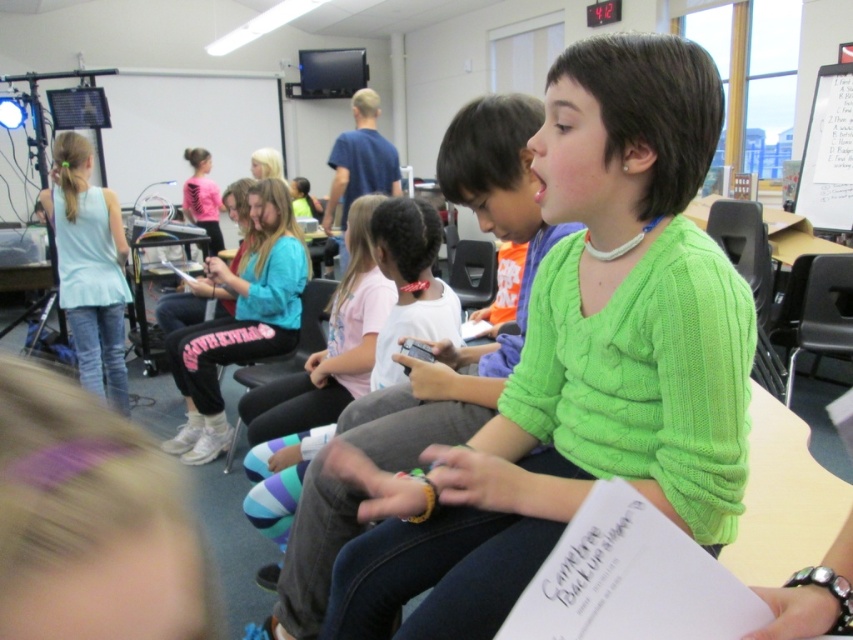
Looking at this image, based on the scene description, which clothing item is shorter in height between the green knitted sweater at center and the light blue fabric shirt at left?

The green knitted sweater at center is shorter in height than the light blue fabric shirt at left.

You are a teacher in the classroom looking at the two students wearing light blue fabric shirt at left and blue cotton shirt at center. Which student is positioned more to the left side of the classroom?

The light blue fabric shirt at left is positioned more to the left side of the classroom than the blue cotton shirt at center.

You are standing in the classroom and see the point at coordinates (x=241, y=320). Which object from the following list is located at that point? The options are the young girl in bright green sweater, the desk, or the pink fabric pants at center.

The point at coordinates (x=241, y=320) is located on the pink fabric pants at center.